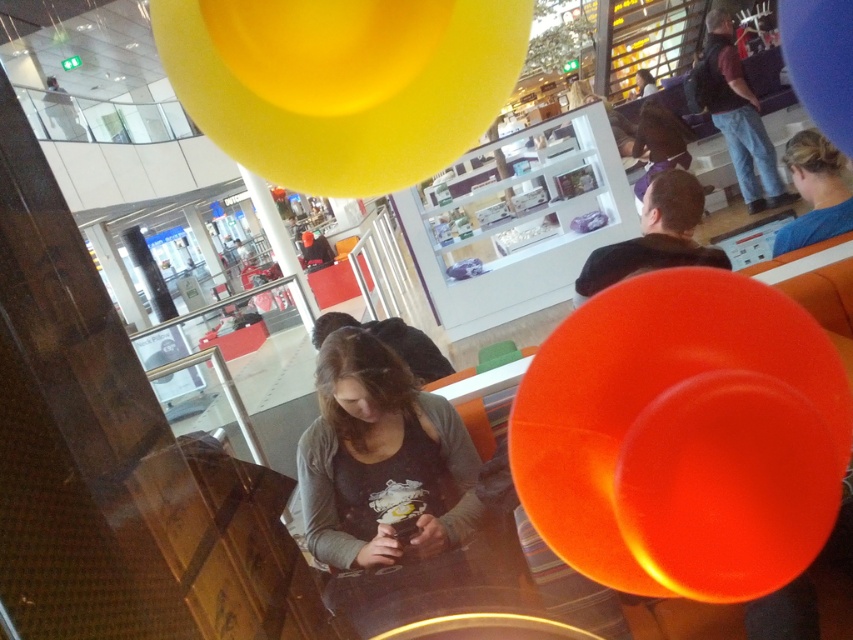
Question: Can you confirm if matte gray shirt at center is positioned above dark blue jeans at upper right?

Choices:
 (A) no
 (B) yes

Answer: (A)

Question: Which point is closer to the camera taking this photo?

Choices:
 (A) (450, 102)
 (B) (820, 10)
 (C) (720, 352)
 (D) (637, 189)

Answer: (C)

Question: Among these points, which one is farthest from the camera?

Choices:
 (A) (744, 308)
 (B) (787, 45)
 (C) (734, 148)

Answer: (C)

Question: Is yellow matte balloon at upper center thinner than matte gray shirt at center?

Choices:
 (A) yes
 (B) no

Answer: (B)

Question: From the image, what is the correct spatial relationship of dark blue jeans at upper right in relation to blue rubber balloon at upper right?

Choices:
 (A) below
 (B) above

Answer: (B)

Question: Which of the following is the closest to the observer?

Choices:
 (A) blue rubber balloon at upper right
 (B) dark blue jeans at upper right

Answer: (A)